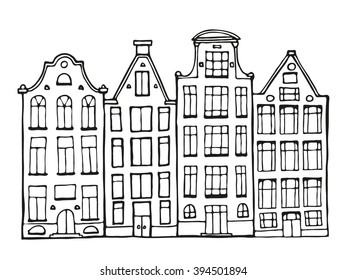
This screenshot has width=347, height=280. Identify the location of door. (62, 229), (145, 223), (215, 229), (293, 230).